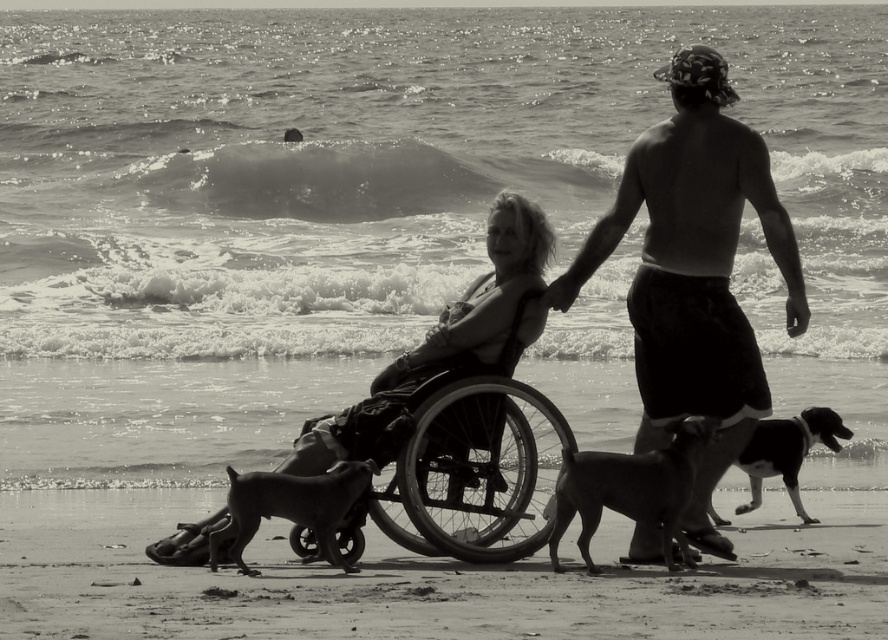
Question: Is dark skin shirtless torso at center to the left of black and white fur dog at lower right from the viewer's perspective?

Choices:
 (A) no
 (B) yes

Answer: (B)

Question: Does metallic wheelchair at center appear under smooth black dog at lower left?

Choices:
 (A) no
 (B) yes

Answer: (A)

Question: Which of the following is the closest to the observer?

Choices:
 (A) smooth brown dog at lower right
 (B) black and white fur dog at lower right

Answer: (A)

Question: Which point is farther to the camera?

Choices:
 (A) black and white fur dog at lower right
 (B) dark skin shirtless torso at center

Answer: (A)

Question: Observing the image, what is the correct spatial positioning of metallic wheelchair at center in reference to black and white fur dog at lower right?

Choices:
 (A) below
 (B) above

Answer: (B)

Question: Which point appears closest to the camera in this image?

Choices:
 (A) (246, 566)
 (B) (736, 314)
 (C) (621, 484)
 (D) (821, 428)

Answer: (C)